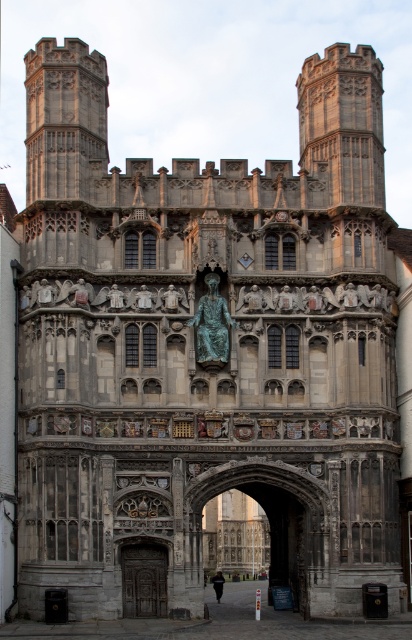
You are a visitor approaching the grand medieval gateway. You see the stone textured tower at upper left and the dark wood door at lower left. Which object is closer to you as you stand at the entrance?

The dark wood door at lower left is behind the stone textured tower at upper left, so the stone textured tower at upper left is closer to you.

You are a visitor approaching the grand medieval gateway. You see the dark wood door at lower left and the green patinated bronze statue at center. Which object is positioned lower in the scene?

The dark wood door at lower left is positioned below the green patinated bronze statue at center, so it is lower in the scene.

In the scene shown: You are an architect designing a new building inspired by this medieval structure. You need to ensure that the dark wood door at lower left and the green patinated bronze statue at center maintain their proportional relationship as seen in the original. Which object should be made larger in your design to keep this proportion?

The dark wood door at lower left should be made larger than the green patinated bronze statue at center to maintain their proportional relationship from the original design.